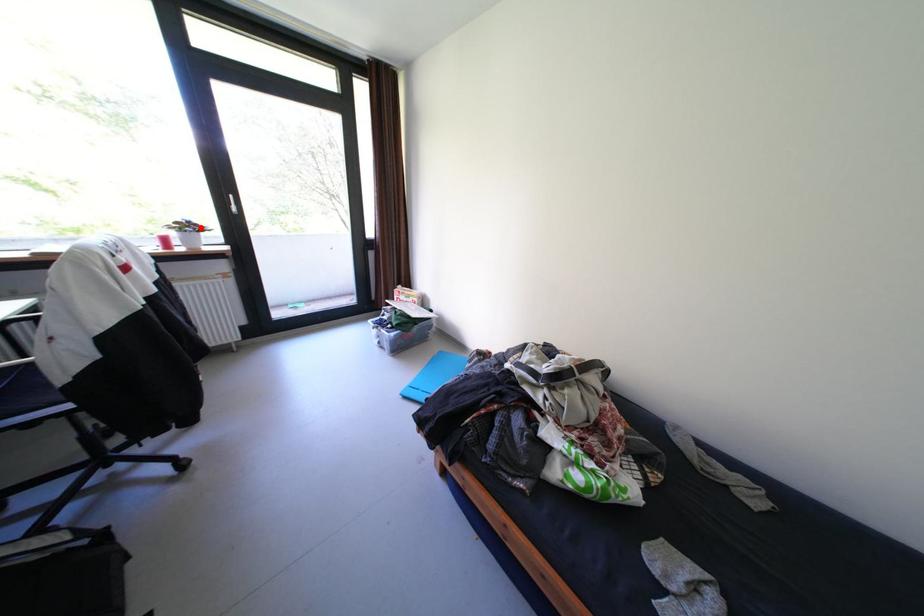
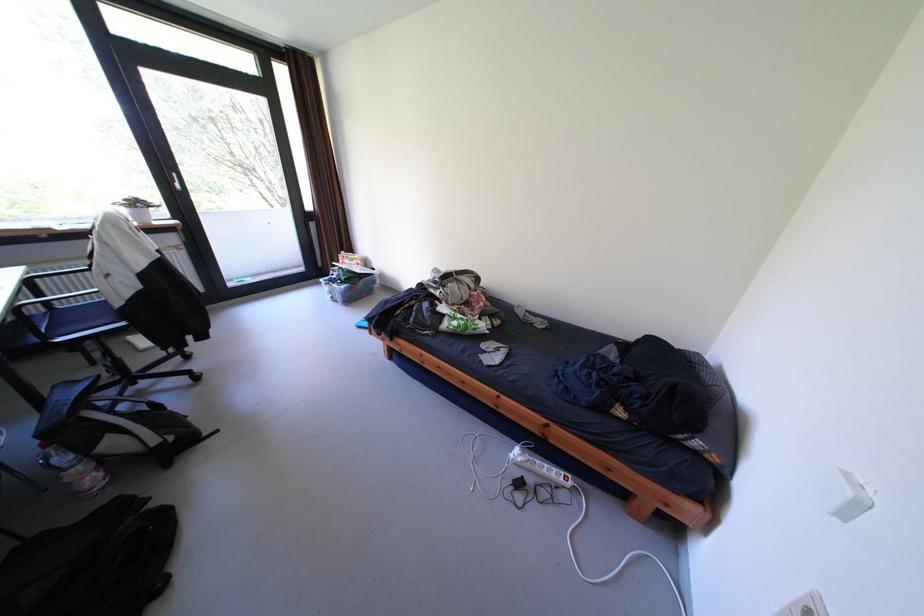
Question: I am providing you with two images of the same scene from different viewpoints. Image1 has a red point marked. In image2, the corresponding 3D location appears at what relative position? Reply with the corresponding letter.

Choices:
 (A) Closer
 (B) Farther

Answer: (B)